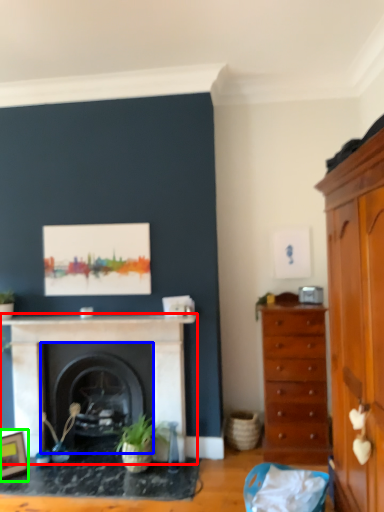
Question: Which object is positioned closest to fireplace (highlighted by a red box)? Select from fireplace (highlighted by a blue box) and picture frame (highlighted by a green box).

Choices:
 (A) fireplace
 (B) picture frame

Answer: (A)